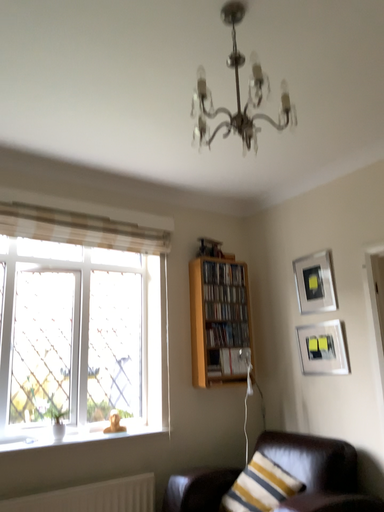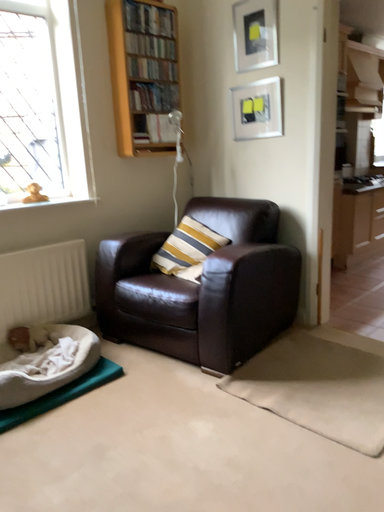
Question: How did the camera likely rotate when shooting the video?

Choices:
 (A) rotated downward
 (B) rotated upward

Answer: (A)